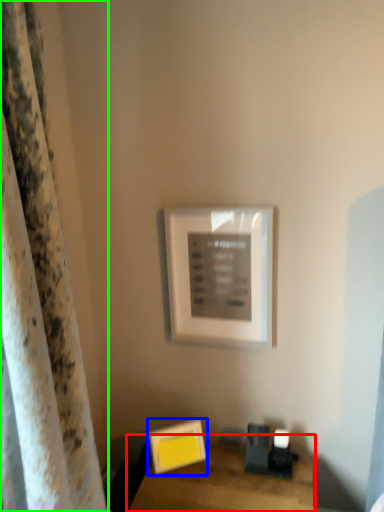
Question: Which is farther away from table (highlighted by a red box)? picture frame (highlighted by a blue box) or curtain (highlighted by a green box)?

Choices:
 (A) picture frame
 (B) curtain

Answer: (B)